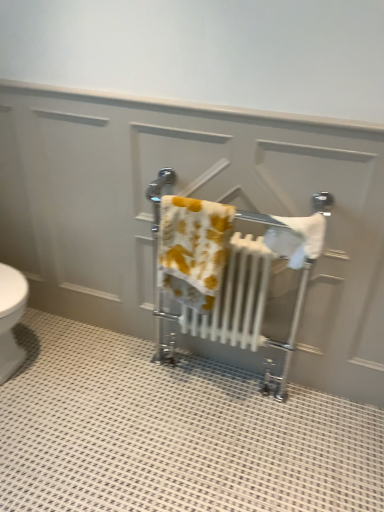
At what (x,y) coordinates should I click in order to perform the action: click on vacant region above yellow printed towel at center, the 1th bath towel positioned from the left (from a real-world perspective). Please return your answer as a coordinate pair (x, y). This screenshot has height=512, width=384. Looking at the image, I should click on (195, 202).